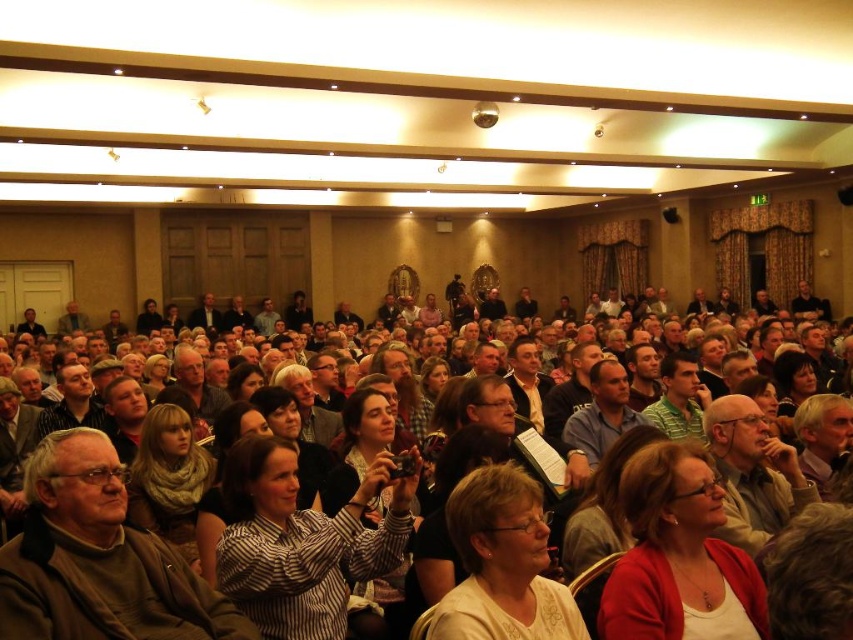
Does striped fabric camera at center have a lesser height compared to light beige shirt at center?

No.

What do you see at coordinates (300, 541) in the screenshot? I see `striped fabric camera at center` at bounding box center [300, 541].

This screenshot has height=640, width=853. In order to click on striped fabric camera at center in this screenshot , I will do `click(300, 541)`.

Who is lower down, light beige shirt at center or matte blue shirt at center?

light beige shirt at center is lower down.

Is point (509, 568) closer to camera compared to point (611, 396)?

Yes, it is in front of point (611, 396).

Image resolution: width=853 pixels, height=640 pixels. I want to click on light beige shirt at center, so click(502, 563).

Is striped shirt at center behind striped fabric camera at center?

That is False.

Between striped shirt at center and striped fabric camera at center, which one is positioned lower?

striped shirt at center

Where is `striped shirt at center`? The image size is (853, 640). striped shirt at center is located at coordinates (97, 560).

You are a GUI agent. You are given a task and a screenshot of the screen. Output one action in this format:
    pyautogui.click(x=<x>, y=<y>)
    Task: Click on the striped shirt at center
    
    Given the screenshot: What is the action you would take?
    tap(97, 560)